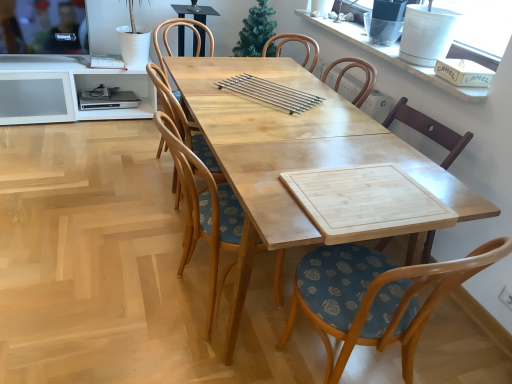
In order to face wooden table at center, should I rotate leftwards or rightwards?

You should look right and rotate roughly 8.142 degrees.

The height and width of the screenshot is (384, 512). Find the location of `wooden chair with floral cushion at center, the first chair in the back-to-front sequence`. wooden chair with floral cushion at center, the first chair in the back-to-front sequence is located at coordinates (183, 122).

Measure the distance between white ceramic vase at upper right and camera.

Answer: 1.79 meters.

Find the location of `wooden chair with floral cushion at center, the 2th chair positioned from the back`. wooden chair with floral cushion at center, the 2th chair positioned from the back is located at coordinates (203, 211).

How different are the orientations of wooden table at center and wooden chair with floral cushion at center, placed as the 3th chair when sorted from back to front, in degrees?

The angle between the facing direction of wooden table at center and the facing direction of wooden chair with floral cushion at center, placed as the 3th chair when sorted from back to front, is 93.6 degrees.

Considering the positions of objects wooden table at center and wooden chair with floral cushion at center, placed as the 3th chair when sorted from back to front, in the image provided, who is more to the right, wooden table at center or wooden chair with floral cushion at center, placed as the 3th chair when sorted from back to front,?

From the viewer's perspective, wooden chair with floral cushion at center, placed as the 3th chair when sorted from back to front, appears more on the right side.

Which of these two, wooden table at center or wooden chair with floral cushion at center, placed as the 3th chair when sorted from back to front, is thinner?

Thinner between the two is wooden table at center.

Does wooden table at center have a lesser height compared to wooden chair with floral cushion at center, placed as the 3th chair when sorted from back to front?

Yes.

Looking at their sizes, would you say wooden chair with floral cushion at center, which appears as the 3th chair when viewed from the front, is wider or thinner than white ceramic vase at upper right?

In the image, wooden chair with floral cushion at center, which appears as the 3th chair when viewed from the front, appears to be wider than white ceramic vase at upper right.

Looking at the image, does wooden chair with floral cushion at center, which appears as the 3th chair when viewed from the front, seem bigger or smaller compared to white ceramic vase at upper right?

In the image, wooden chair with floral cushion at center, which appears as the 3th chair when viewed from the front, appears to be larger than white ceramic vase at upper right.

Could you measure the distance between wooden chair with floral cushion at center, the first chair in the back-to-front sequence, and white ceramic vase at upper right?

wooden chair with floral cushion at center, the first chair in the back-to-front sequence, is 1.19 meters away from white ceramic vase at upper right.

From a real-world perspective, is wooden chair with floral cushion at center, which appears as the 3th chair when viewed from the front, physically located above or below white ceramic vase at upper right?

Clearly, from a real-world perspective, wooden chair with floral cushion at center, which appears as the 3th chair when viewed from the front, is below white ceramic vase at upper right.

Is wooden chair with floral cushion at center, which is the first chair in front-to-back order, a part of light wood table at center?

Yes.

Which is closer, (205,101) or (355,262)?

Point (205,101) appears to be farther away from the viewer than point (355,262).

Can you confirm if light wood table at center is thinner than wooden chair with floral cushion at center, placed as the 3th chair when sorted from back to front?

In fact, light wood table at center might be wider than wooden chair with floral cushion at center, placed as the 3th chair when sorted from back to front.

What's the angular difference between wooden chair with floral cushion at center, the second chair positioned from the front, and white ceramic vase at upper right's facing directions?

The facing directions of wooden chair with floral cushion at center, the second chair positioned from the front, and white ceramic vase at upper right are 174 degrees apart.

Which object is closer to the camera, wooden chair with floral cushion at center, the second chair positioned from the front, or white ceramic vase at upper right?

Positioned in front is wooden chair with floral cushion at center, the second chair positioned from the front.

Would you say wooden chair with floral cushion at center, the second chair positioned from the front, is to the left or to the right of white ceramic vase at upper right in the picture?

Clearly, wooden chair with floral cushion at center, the second chair positioned from the front, is on the left of white ceramic vase at upper right in the image.

Between point (174, 156) and point (388, 55), which one is positioned in front?

The point (174, 156) is in front.

From a real-world perspective, is white ceramic vase at upper right located higher than wooden chair with floral cushion at center, which appears as the 3th chair when viewed from the front?

Yes, from a real-world perspective, white ceramic vase at upper right is on top of wooden chair with floral cushion at center, which appears as the 3th chair when viewed from the front.

Looking at this image, is white ceramic vase at upper right taller or shorter than wooden chair with floral cushion at center, which appears as the 3th chair when viewed from the front?

white ceramic vase at upper right is shorter than wooden chair with floral cushion at center, which appears as the 3th chair when viewed from the front.

Could you measure the distance between white ceramic vase at upper right and wooden chair with floral cushion at center, the first chair in the back-to-front sequence?

white ceramic vase at upper right and wooden chair with floral cushion at center, the first chair in the back-to-front sequence, are 3.89 feet apart.

Is wooden chair with floral cushion at center, the second chair positioned from the front, situated inside wooden table at center or outside?

wooden chair with floral cushion at center, the second chair positioned from the front, is located beyond the bounds of wooden table at center.

Is wooden chair with floral cushion at center, the second chair positioned from the front, in front of or behind wooden table at center in the image?

In the image, wooden chair with floral cushion at center, the second chair positioned from the front, appears in front of wooden table at center.

From the image's perspective, which one is positioned lower, wooden chair with floral cushion at center, the 2th chair positioned from the back, or wooden table at center?

wooden chair with floral cushion at center, the 2th chair positioned from the back, appears lower in the image.

Which of these two, wooden chair with floral cushion at center, the second chair positioned from the front, or wooden table at center, stands shorter?

wooden table at center.

From the picture: Considering the relative sizes of light wood table at center and wooden chair with floral cushion at center, the second chair positioned from the front, in the image provided, is light wood table at center shorter than wooden chair with floral cushion at center, the second chair positioned from the front,?

Yes, light wood table at center is shorter than wooden chair with floral cushion at center, the second chair positioned from the front.

Locate an element on the screen. This screenshot has height=384, width=512. the 2nd chair positioned above the light wood table at center (from a real-world perspective) is located at coordinates (203, 211).

Is light wood table at center far from wooden chair with floral cushion at center, the 2th chair positioned from the back?

light wood table at center is actually quite close to wooden chair with floral cushion at center, the 2th chair positioned from the back.

Is light wood table at center to the left of wooden chair with floral cushion at center, the 2th chair positioned from the back, from the viewer's perspective?

No, light wood table at center is not to the left of wooden chair with floral cushion at center, the 2th chair positioned from the back.

From the image's perspective, count 2nd chairs downward from the wooden table at center and point to it. Please provide its 2D coordinates.

[(375, 297)]

I want to click on window sill in front of the wooden chair with floral cushion at center, which appears as the 3th chair when viewed from the front, so click(x=393, y=56).

Looking at the image, which one is located closer to wooden chair with floral cushion at center, the first chair in the back-to-front sequence, wooden chair with floral cushion at center, the second chair positioned from the front, or white ceramic vase at upper right?

wooden chair with floral cushion at center, the second chair positioned from the front, is positioned closer to the anchor wooden chair with floral cushion at center, the first chair in the back-to-front sequence.

Considering their positions, is light wood table at center positioned further to wooden table at center than wooden chair with floral cushion at center, which is the first chair in front-to-back order?

wooden chair with floral cushion at center, which is the first chair in front-to-back order, is positioned further to the anchor wooden table at center.

In the scene shown: Looking at the image, which one is located closer to wooden table at center, white ceramic vase at upper right or wooden chair with floral cushion at center, which is the first chair in front-to-back order?

white ceramic vase at upper right is positioned closer to the anchor wooden table at center.

Looking at the image, which one is located further to wooden chair with floral cushion at center, the first chair in the back-to-front sequence, wooden chair with floral cushion at center, placed as the 3th chair when sorted from back to front, or white ceramic vase at upper right?

Based on the image, white ceramic vase at upper right appears to be further to wooden chair with floral cushion at center, the first chair in the back-to-front sequence.

Estimate the real-world distances between objects in this image. Which object is closer to wooden chair with floral cushion at center, the 2th chair positioned from the back, wooden chair with floral cushion at center, which appears as the 3th chair when viewed from the front, or wooden chair with floral cushion at center, which is the first chair in front-to-back order?

wooden chair with floral cushion at center, which appears as the 3th chair when viewed from the front, is closer to wooden chair with floral cushion at center, the 2th chair positioned from the back.

When comparing their distances from wooden chair with floral cushion at center, the 2th chair positioned from the back, does wooden chair with floral cushion at center, placed as the 3th chair when sorted from back to front, or light wood table at center seem closer?

light wood table at center is closer to wooden chair with floral cushion at center, the 2th chair positioned from the back.

From the image, which object appears to be farther from wooden table at center, light wood table at center or wooden chair with floral cushion at center, the second chair positioned from the front?

wooden chair with floral cushion at center, the second chair positioned from the front, is positioned further to the anchor wooden table at center.

Considering their positions, is wooden table at center positioned closer to wooden chair with floral cushion at center, the first chair in the back-to-front sequence, than light wood table at center?

Based on the image, wooden table at center appears to be nearer to wooden chair with floral cushion at center, the first chair in the back-to-front sequence.

Locate an element on the screen. kitchen & dining room table between light wood table at center and wooden chair with floral cushion at center, the first chair in the back-to-front sequence, along the z-axis is located at coordinates (262, 102).

This screenshot has height=384, width=512. I want to click on desk between white ceramic vase at upper right and wooden chair with floral cushion at center, which is the first chair in front-to-back order, in the vertical direction, so click(x=293, y=155).

Locate an element on the screen. The height and width of the screenshot is (384, 512). desk between wooden chair with floral cushion at center, placed as the 3th chair when sorted from back to front, and wooden table at center, along the z-axis is located at coordinates (293, 155).

Find the location of a particular element. The width and height of the screenshot is (512, 384). desk located between wooden chair with floral cushion at center, the 2th chair positioned from the back, and wooden chair with floral cushion at center, placed as the 3th chair when sorted from back to front, in the left-right direction is located at coordinates (293, 155).